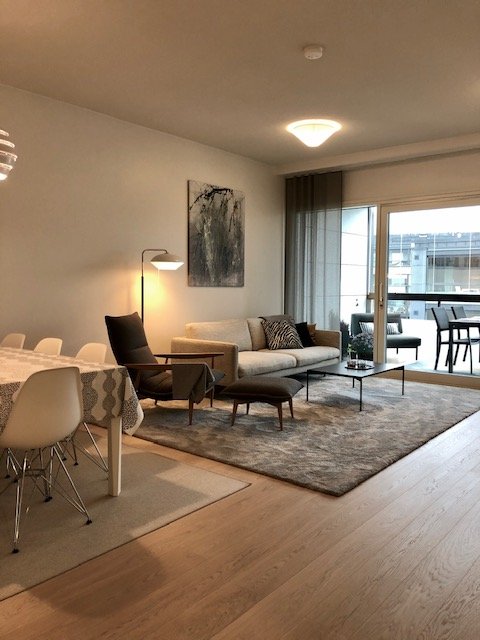
Image resolution: width=480 pixels, height=640 pixels. I want to click on small white chairs, so coord(57,396), coord(89,353), coord(54,344), coord(14,338).